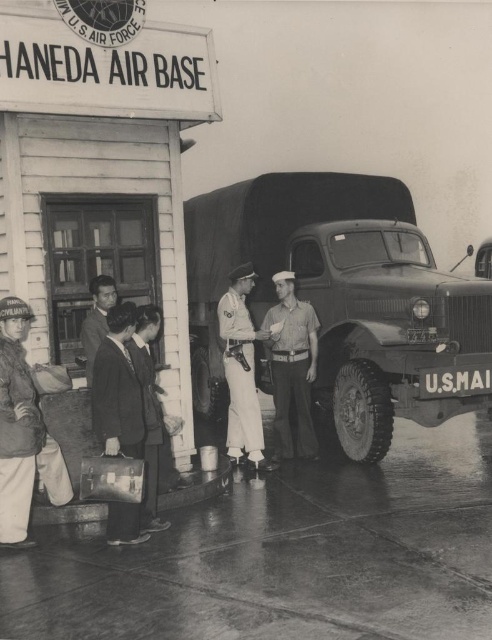
Consider the image. You are a photographer standing at Haneda Air Base and want to take a picture of the matte green truck at center and the light brown uniform at center. Which object should you focus on first if you want to capture both in the same frame without moving your camera?

The matte green truck at center is not as tall as the light brown uniform at center, so you should focus on the light brown uniform at center first to ensure it fits within the frame.

You are a courier at Haneda Air Base and need to load a smooth leather briefcase at center and a dark suit at center into the back of the U.S. Army truck. The truck has a loading height restriction of 1 meter. Can both items fit vertically without exceeding the height limit?

A: The smooth leather briefcase at center is taller than the dark suit at center. However, since the exact heights are not provided, we cannot determine if both items will fit within the 1 meter height restriction. Additional measurements are needed.